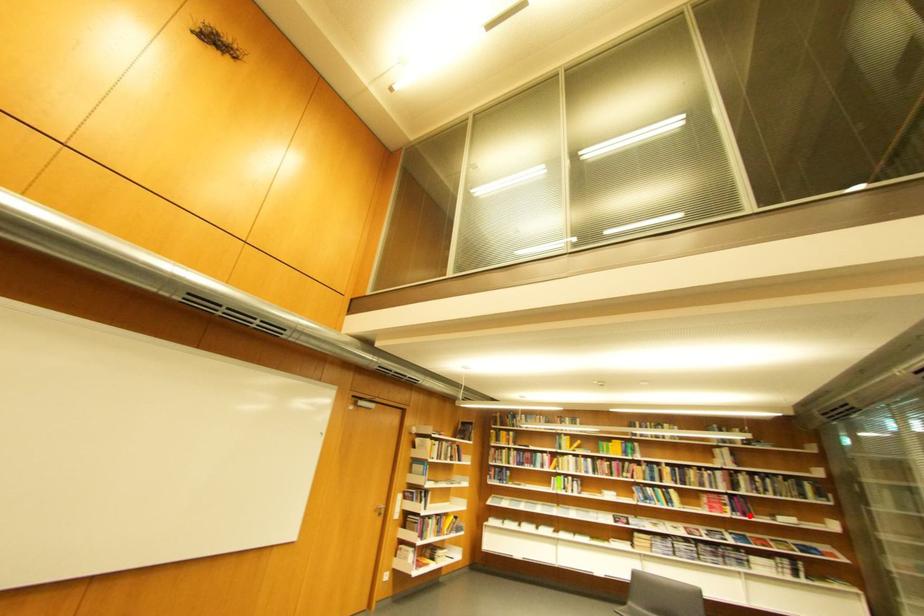
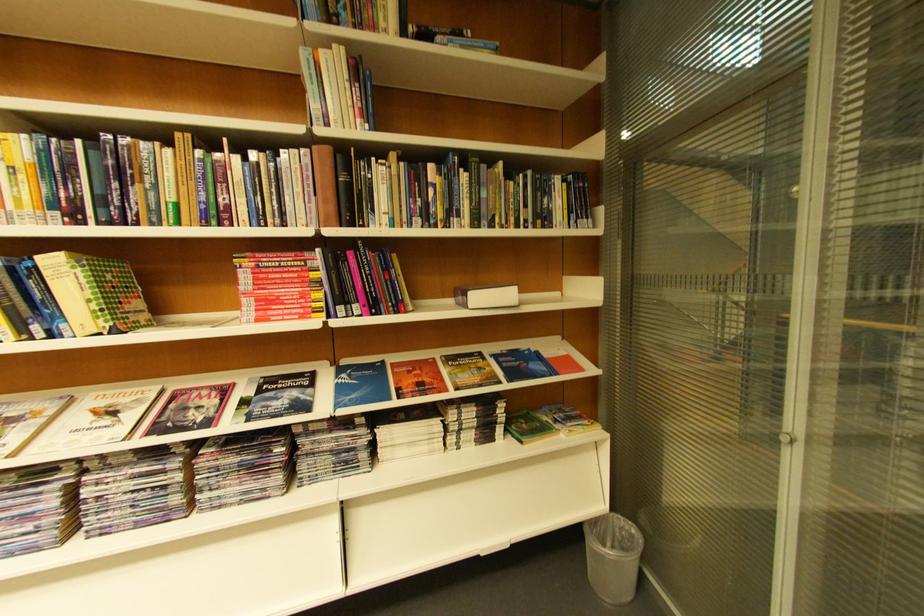
Question: I am providing you with two images of the same scene from different viewpoints. Image1 has a red point marked. In image2, the corresponding 3D location appears at what relative position? Reply with the corresponding letter.

Choices:
 (A) Closer
 (B) Farther

Answer: (B)